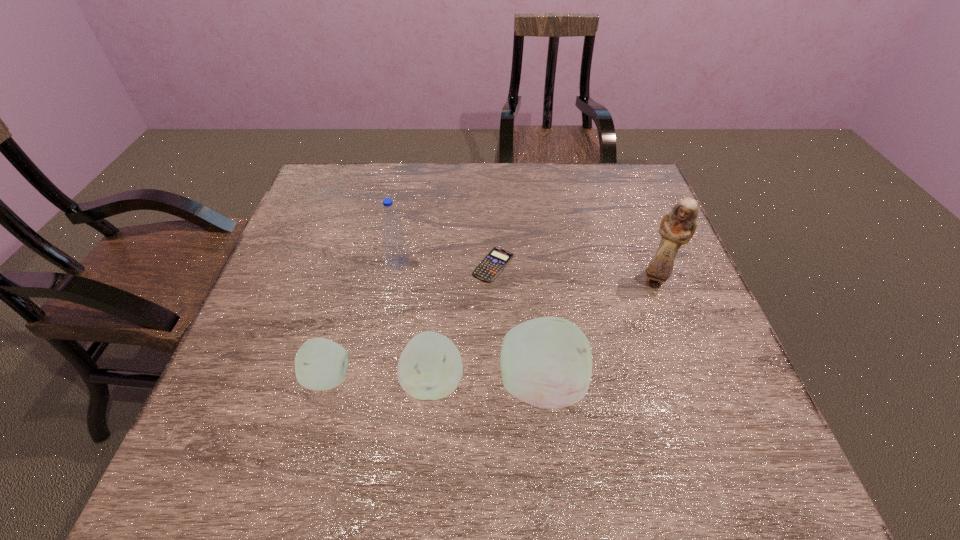
The width and height of the screenshot is (960, 540). Identify the location of the leftmost apple. (320, 364).

Find the location of a particular element. Image resolution: width=960 pixels, height=540 pixels. the second shortest object is located at coordinates (320, 364).

I want to click on the fourth object from right to left, so click(430, 367).

You are a GUI agent. You are given a task and a screenshot of the screen. Output one action in this format:
    pyautogui.click(x=<x>, y=<y>)
    Task: Click on the third shortest object
    
    Given the screenshot: What is the action you would take?
    pyautogui.click(x=430, y=367)

What are the coordinates of `the tallest apple` in the screenshot? It's located at (547, 362).

Image resolution: width=960 pixels, height=540 pixels. I want to click on water bottle, so click(x=395, y=245).

Identify the location of calculator. The image size is (960, 540). (489, 268).

The width and height of the screenshot is (960, 540). I want to click on the tallest object, so click(x=677, y=227).

You are a GUI agent. You are given a task and a screenshot of the screen. Output one action in this format:
    pyautogui.click(x=<x>, y=<y>)
    Task: Click on the rightmost object
    The width and height of the screenshot is (960, 540).
    Given the screenshot: What is the action you would take?
    pyautogui.click(x=677, y=227)

Where is `free region located 0.240m on the right of the second shortest object`? This screenshot has height=540, width=960. free region located 0.240m on the right of the second shortest object is located at coordinates (470, 378).